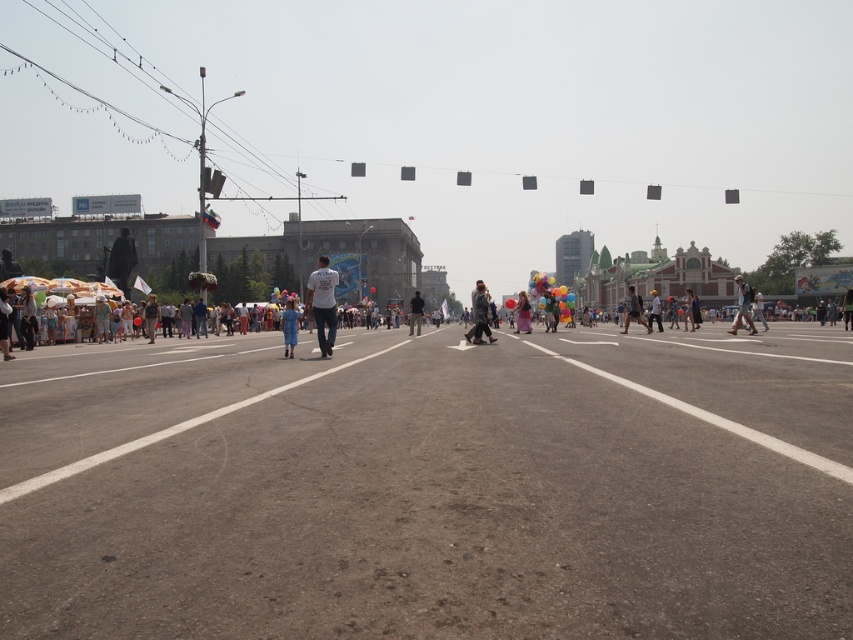
Question: Among these objects, which one is farthest from the camera?

Choices:
 (A) white t-shirt at center
 (B) dark blue jeans at center
 (C) multicolored balloons at center

Answer: (C)

Question: From the image, what is the correct spatial relationship of matte blue dress at center in relation to pink satin dress at center?

Choices:
 (A) left
 (B) right

Answer: (A)

Question: Is white t-shirt at center closer to camera compared to multicolored balloons at center?

Choices:
 (A) no
 (B) yes

Answer: (B)

Question: Which object is closer to the camera taking this photo?

Choices:
 (A) dark gray jacket at center
 (B) matte blue dress at center

Answer: (B)

Question: Observing the image, what is the correct spatial positioning of dark blue jeans at center in reference to pink satin dress at center?

Choices:
 (A) right
 (B) left

Answer: (A)

Question: Which of the following is the farthest from the observer?

Choices:
 (A) tap(631, 308)
 (B) tap(281, 316)
 (C) tap(514, 308)

Answer: (C)